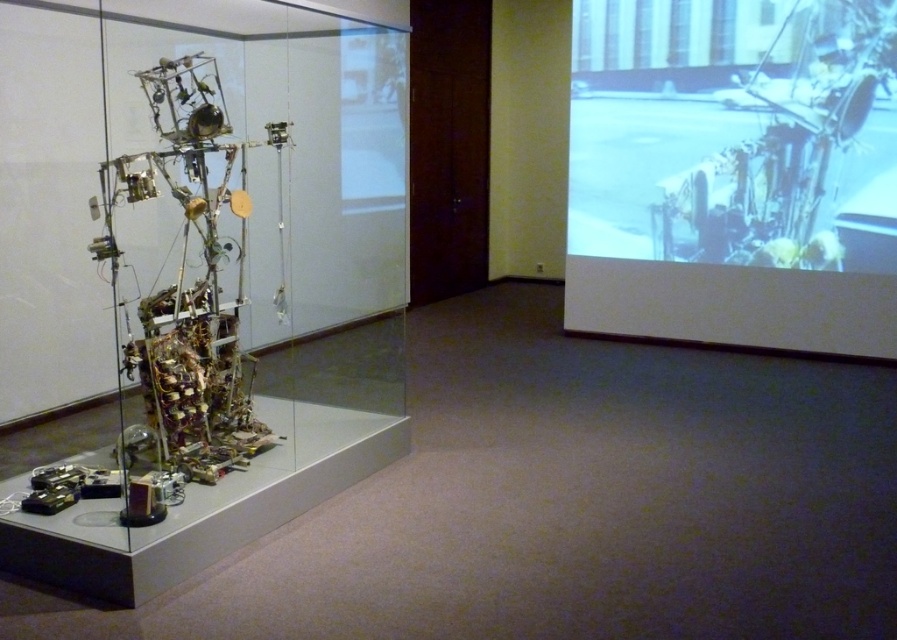
Question: Which point appears closest to the camera in this image?

Choices:
 (A) (815, 168)
 (B) (80, 593)

Answer: (B)

Question: In this image, where is transparent glass sculpture at left located relative to white matte screen at upper right?

Choices:
 (A) below
 (B) above

Answer: (A)

Question: Which point is closer to the camera?

Choices:
 (A) pyautogui.click(x=109, y=525)
 (B) pyautogui.click(x=737, y=49)

Answer: (A)

Question: Which point is farther from the camera taking this photo?

Choices:
 (A) (699, 193)
 (B) (137, 328)

Answer: (A)

Question: Is transparent glass sculpture at left smaller than white matte screen at upper right?

Choices:
 (A) no
 (B) yes

Answer: (A)

Question: Is transparent glass sculpture at left positioned before white matte screen at upper right?

Choices:
 (A) no
 (B) yes

Answer: (B)